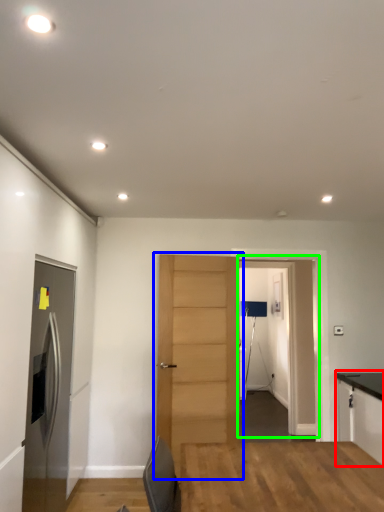
Question: Considering the real-world distances, which object is farthest from cabinetry (highlighted by a red box)? door (highlighted by a blue box) or glass door (highlighted by a green box)?

Choices:
 (A) door
 (B) glass door

Answer: (B)